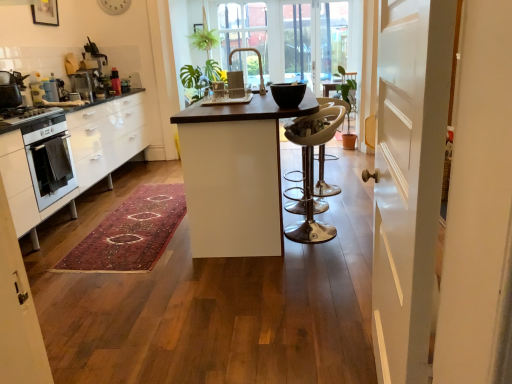
At what (x,y) coordinates should I click in order to perform the action: click on vacant space underneath black glossy bowl at center, which is the fourth appliance in left-to-right order (from a real-world perspective). Please return your answer as a coordinate pair (x, y). This screenshot has height=384, width=512. Looking at the image, I should click on (289, 101).